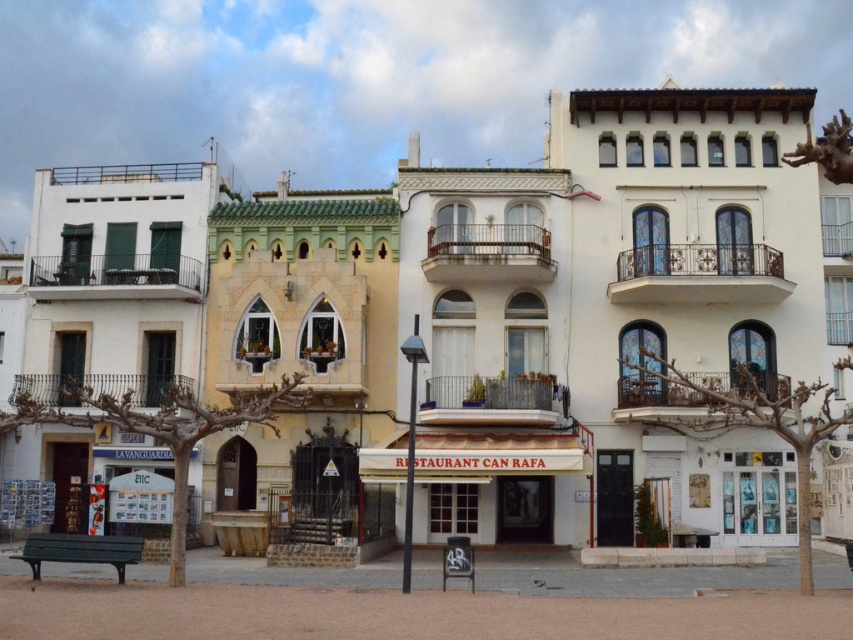
You are standing on the street looking at the buildings. There are two points marked on the buildings. One is at point (161,276) and the other is at point (312,397). Which point is closer to you?

Point (161,276) is closer to you because it is further to the camera than point (312,397).

You are standing on the street looking at the row of buildings. There is a point marked at coordinates (693, 288). Which building does this point correspond to?

The point at coordinates (693, 288) corresponds to the white textured building at center.

You are standing at the point with coordinates 0.5, 0.8. You want to walk to the white textured building at center. In which direction should you move?

You should move west because the white textured building at center is located at point [693,288], which is to the west of your current position at [682,320].